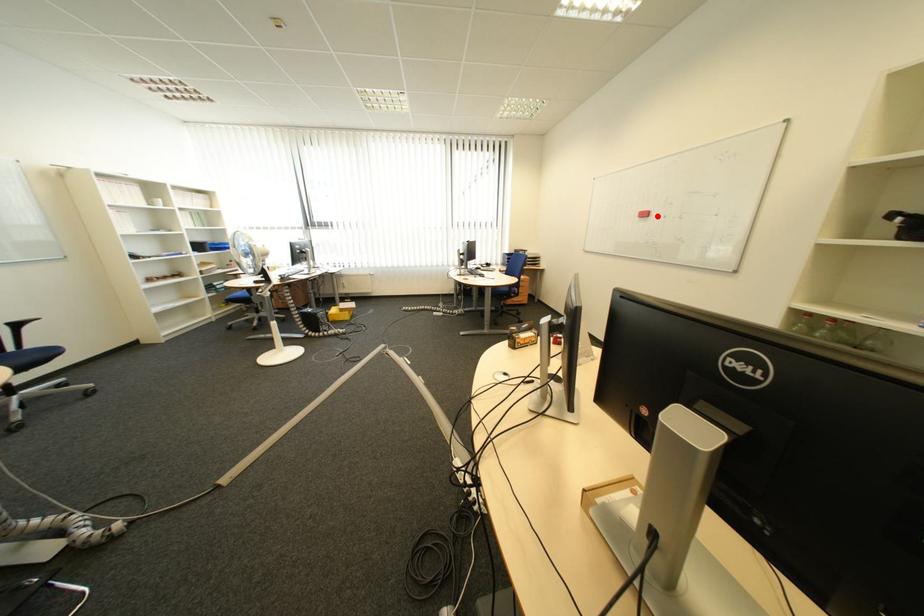
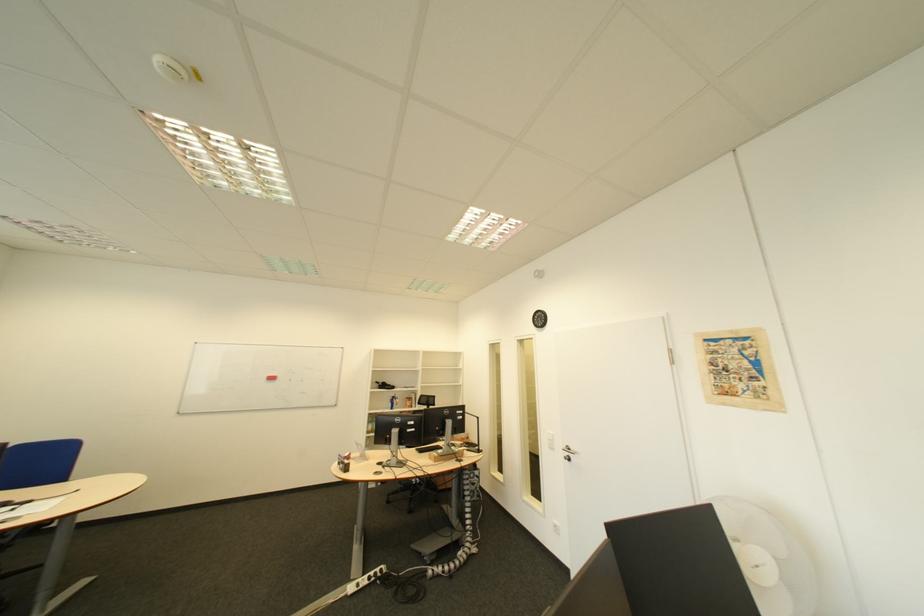
The point at the highlighted location is marked in the first image. Where is the corresponding point in the second image?

(285, 379)